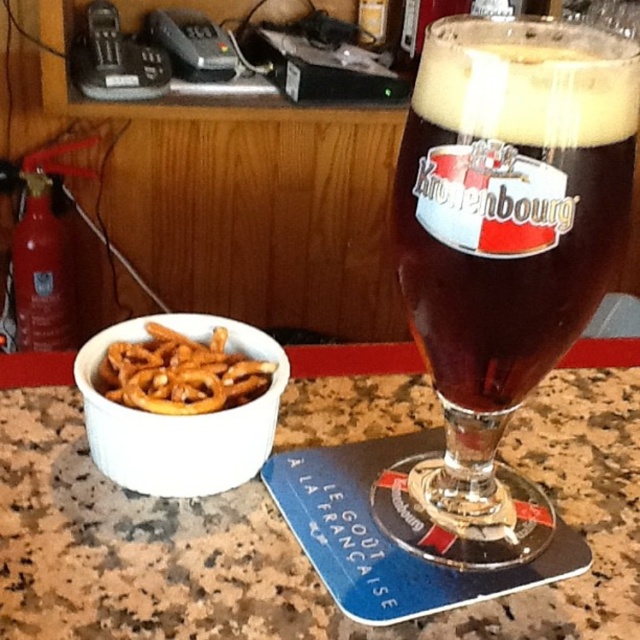
Question: Estimate the real-world distances between objects in this image. Which object is closer to the dark brown glass at center?

Choices:
 (A) golden crispy pretzels at lower left
 (B) granite countertop at center
 (C) white ceramic bowl at left

Answer: (C)

Question: Is white ceramic bowl at left positioned before golden crispy pretzels at lower left?

Choices:
 (A) no
 (B) yes

Answer: (B)

Question: Which is nearer to the white ceramic bowl at left?

Choices:
 (A) golden crispy pretzels at lower left
 (B) dark brown glass at center
 (C) granite countertop at center

Answer: (A)

Question: Does granite countertop at center have a smaller size compared to dark brown glass at center?

Choices:
 (A) no
 (B) yes

Answer: (A)

Question: Is granite countertop at center below golden crispy pretzels at lower left?

Choices:
 (A) no
 (B) yes

Answer: (B)

Question: Considering the real-world distances, which object is closest to the dark brown glass at center?

Choices:
 (A) granite countertop at center
 (B) white ceramic bowl at left
 (C) golden crispy pretzels at lower left

Answer: (B)